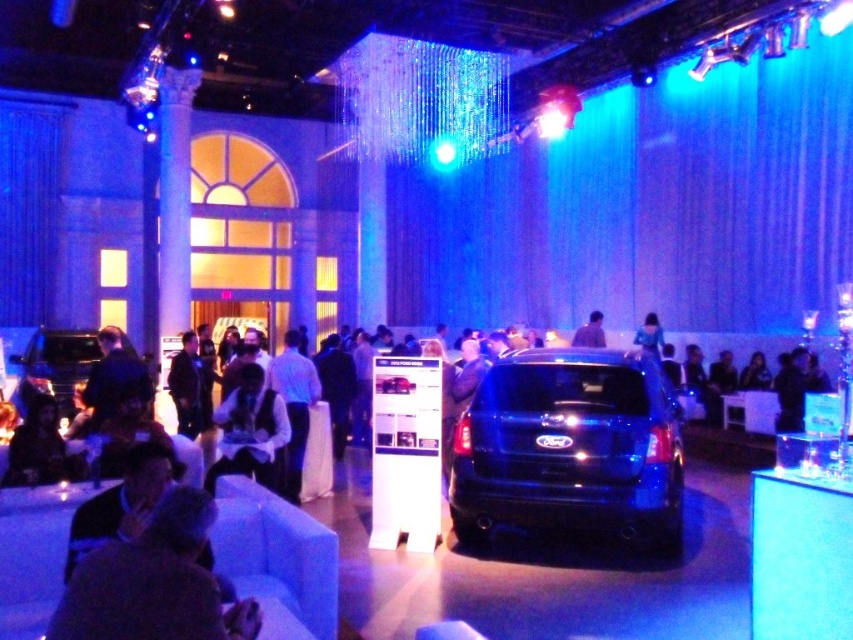
You are planning to place a new decorative item in the center of the showroom floor. However, there is already a satin blue suv at center and a white satin vest at center occupying the space. What is the minimum distance you need to maintain between the new item and the existing ones to ensure it doesn

The satin blue suv at center is 2.03 meters away from the white satin vest at center. To ensure the new item maintains a safe distance from both, it should be placed at least 1.015 meters away from each object, as this is half the distance between them.

You are a photographer setting up for an event at the car showroom. You need to position a camera to capture both the satin blue suv at center and the white satin vest at center in the same frame. Based on their positions, which object should be placed lower in the frame to include both?

The satin blue suv at center is located below the white satin vest at center, so to include both in the frame, the camera should be positioned to have the satin blue suv at center lower in the frame and the white satin vest at center higher up.

You are a parking attendant who needs to move a car that is 5 meters long. You see the satin blue suv at center and the matte black car at center in the showroom. Can you fit the car between them without moving either vehicle?

The distance between the satin blue suv at center and the matte black car at center is 5.54 meters. Since the car to be parked is 5 meters long, there is enough space to fit it between them without moving either vehicle.